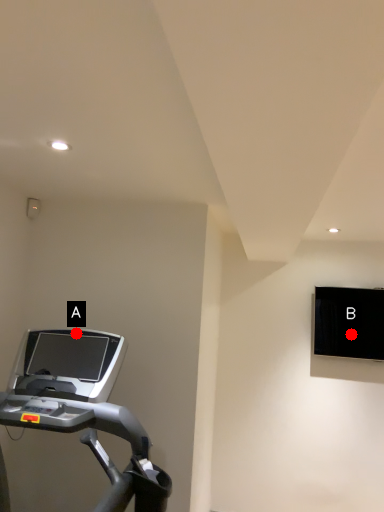
Question: Two points are circled on the image, labeled by A and B beside each circle. Among these points, which one is nearest to the camera?

Choices:
 (A) A is closer
 (B) B is closer

Answer: (A)